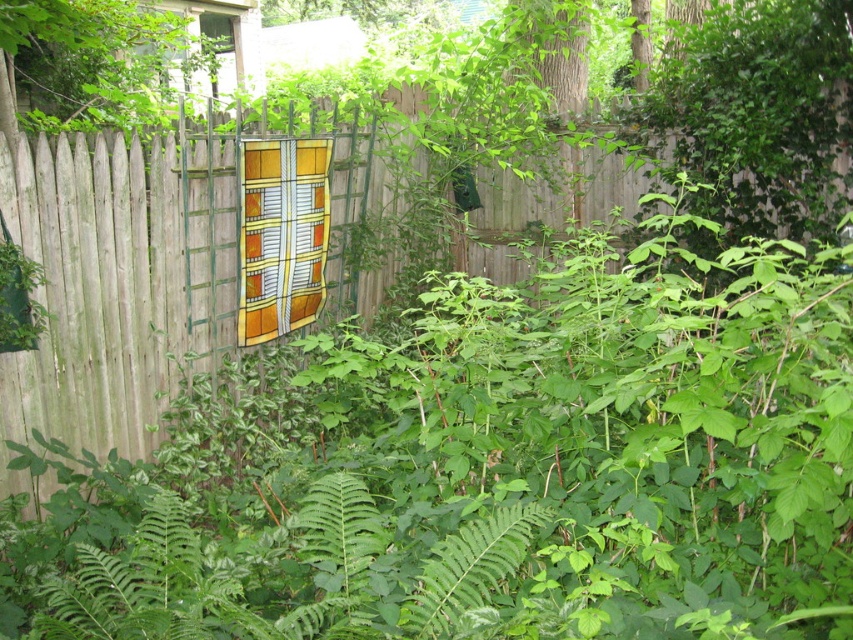
Question: Which point is farther from the camera taking this photo?

Choices:
 (A) (62, 125)
 (B) (216, 19)

Answer: (B)

Question: Is wooden fence at center below transparent glass window at upper center?

Choices:
 (A) yes
 (B) no

Answer: (A)

Question: Is wooden fence at center closer to camera compared to transparent glass window at upper center?

Choices:
 (A) no
 (B) yes

Answer: (B)

Question: Does green leafy tree at upper left appear over transparent glass window at upper center?

Choices:
 (A) no
 (B) yes

Answer: (A)

Question: Which object appears farthest from the camera in this image?

Choices:
 (A) transparent glass window at upper center
 (B) green leafy tree at upper left

Answer: (A)

Question: Based on their relative distances, which object is farther from the wooden fence at center?

Choices:
 (A) transparent glass window at upper center
 (B) green leafy tree at upper left

Answer: (A)